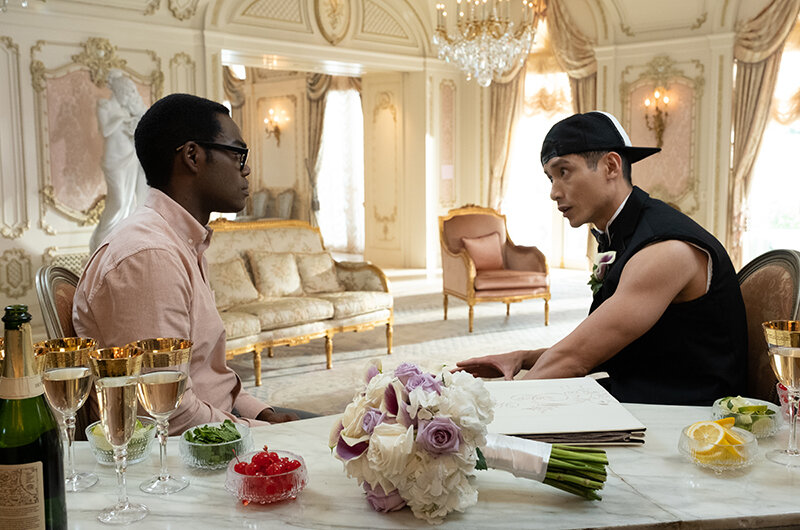
The image size is (800, 530). Identify the location of pillows. (312, 269), (270, 265), (224, 288), (493, 251).